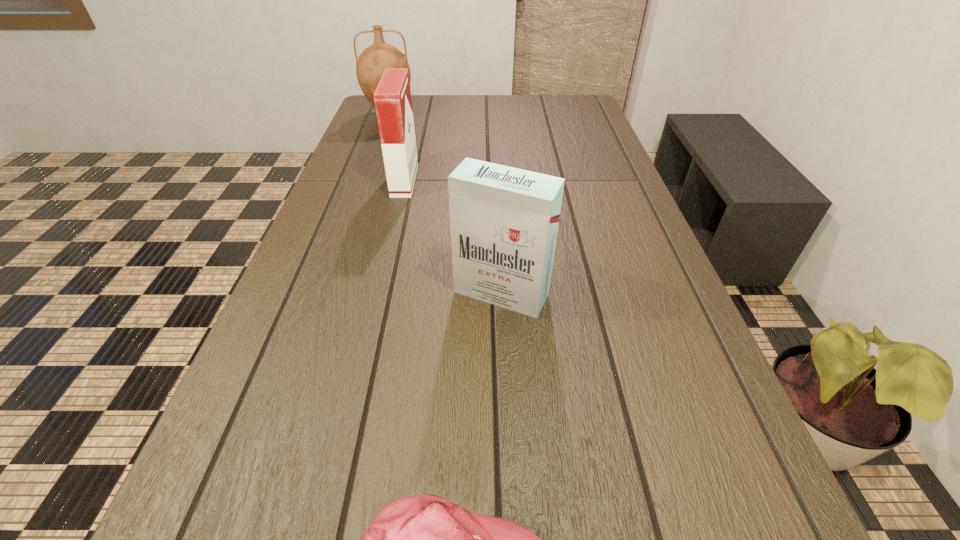
This screenshot has width=960, height=540. Find the location of `cigarette_case that is positioned at the left edge`. cigarette_case that is positioned at the left edge is located at coordinates (392, 97).

Locate an element on the screen. This screenshot has height=540, width=960. object that is at the far left corner is located at coordinates (370, 65).

Locate an element on the screen. This screenshot has width=960, height=540. vacant region at the far edge of the desktop is located at coordinates (447, 110).

In the image, there is a desktop. Where is `vacant space at the left edge`? vacant space at the left edge is located at coordinates (256, 380).

I want to click on vacant space at the right edge of the desktop, so click(612, 162).

I want to click on vacant area at the far left corner, so pyautogui.click(x=413, y=108).

Locate an element on the screen. The height and width of the screenshot is (540, 960). vacant space at the far right corner is located at coordinates tap(575, 96).

Locate an element on the screen. The height and width of the screenshot is (540, 960). free space that is in between the farthest object and the right cigarette case is located at coordinates (445, 204).

Find the location of a particular element. The image size is (960, 540). vacant space in between the right cigarette case and the pitcher is located at coordinates (445, 204).

Select which object appears as the third closest to the baseball cap. Please provide its 2D coordinates. Your answer should be formatted as a tuple, i.e. [(x, y)], where the tuple contains the x and y coordinates of a point satisfying the conditions above.

[(370, 65)]